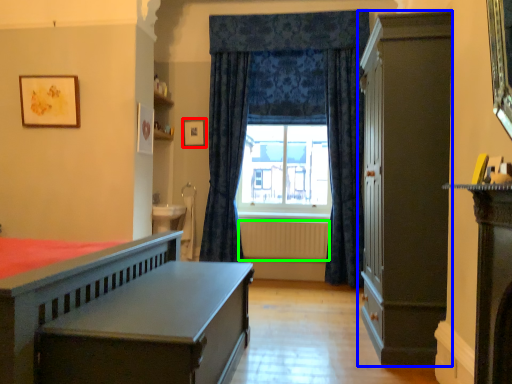
Question: Estimate the real-world distances between objects in this image. Which object is farther from picture frame (highlighted by a red box), cabinetry (highlighted by a blue box) or radiator (highlighted by a green box)?

Choices:
 (A) cabinetry
 (B) radiator

Answer: (A)